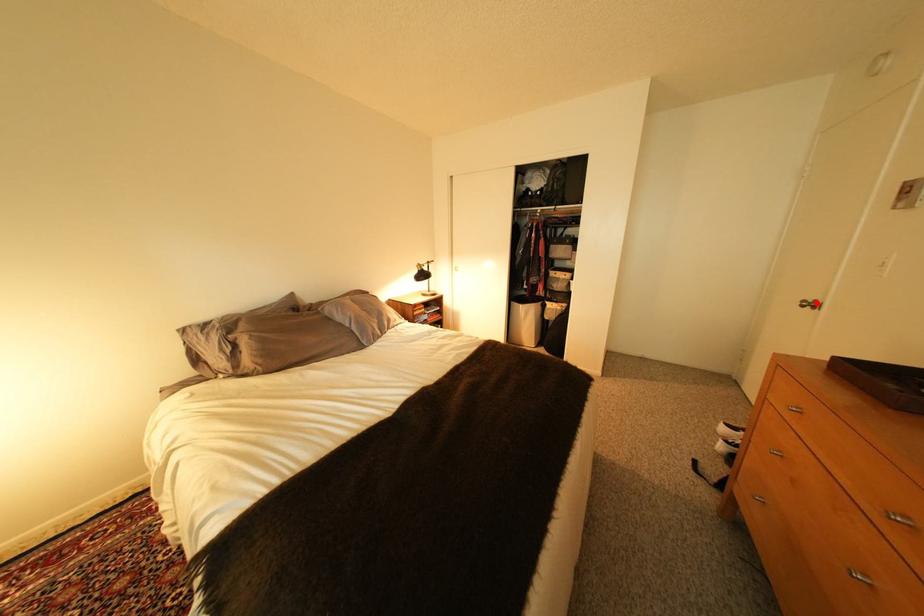
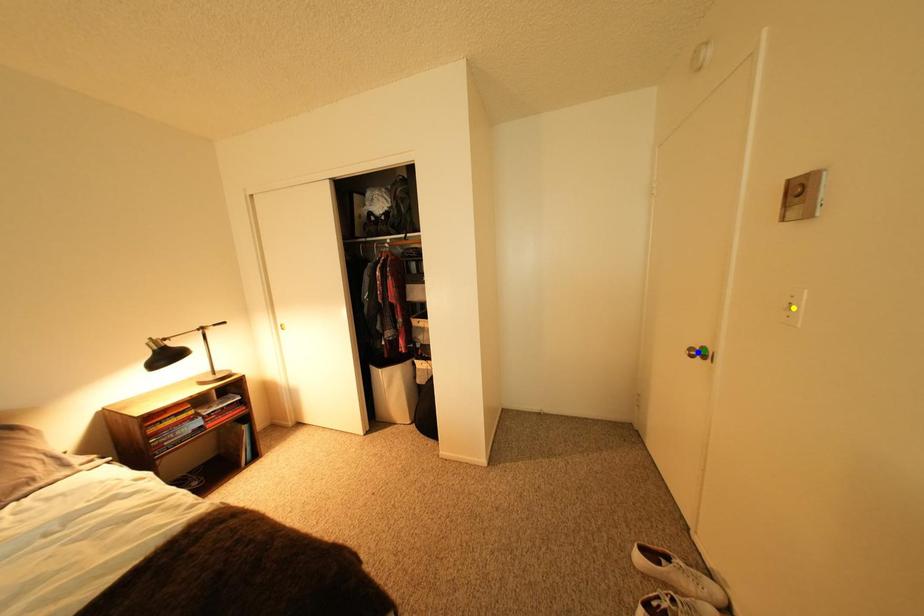
Question: I am providing you with two images of the same scene from different viewpoints. A red point is marked on the first image. You are given multiple points on the second image. Can you choose the point in image 2 that corresponds to the point in image 1?

Choices:
 (A) yellow point
 (B) green point
 (C) blue point

Answer: (B)